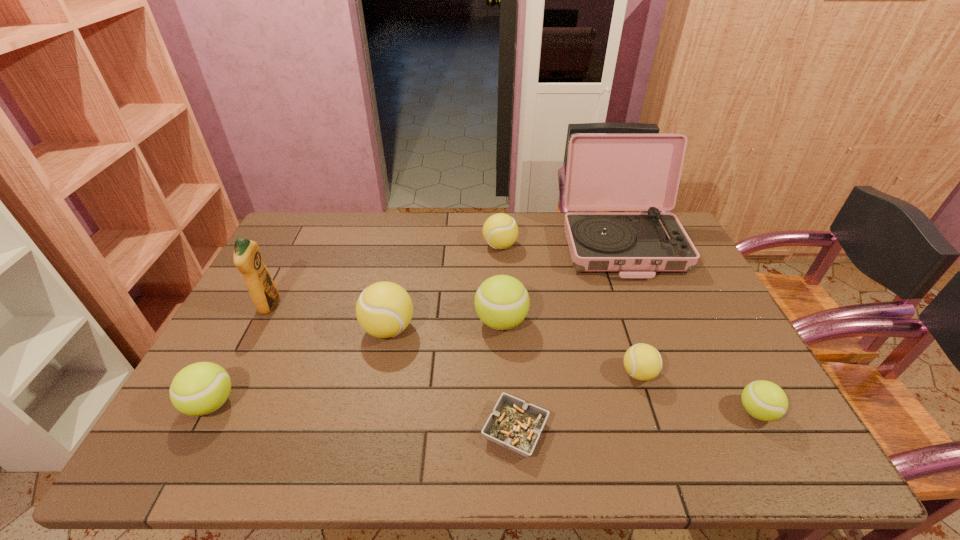
Locate an element on the screen. vacant space that's between the ashtray and the record player is located at coordinates click(x=568, y=338).

Locate an element on the screen. free space between the smallest yellow tennis ball and the second tallest object is located at coordinates (454, 340).

This screenshot has height=540, width=960. I want to click on free space between the ashtray and the detergent, so click(393, 368).

Identify the location of free space between the detergent and the seventh object from right to left. (328, 317).

Find the location of a particular element. vacant space in between the tallest object and the farthest tennis ball is located at coordinates (561, 245).

What are the coordinates of `unoccupied area between the second tallest object and the smallest yellow tennis ball` in the screenshot? It's located at (454, 340).

Identify the location of free space between the fifth tennis ball from left to right and the second tallest object. (454, 340).

Image resolution: width=960 pixels, height=540 pixels. Find the location of `free space between the rightmost yellow tennis ball and the detergent`. free space between the rightmost yellow tennis ball and the detergent is located at coordinates pyautogui.click(x=454, y=340).

You are a GUI agent. You are given a task and a screenshot of the screen. Output one action in this format:
    pyautogui.click(x=<x>, y=<y>)
    Task: Click on the vacant space that is in between the shortest object and the leftmost green tennis ball
    
    Given the screenshot: What is the action you would take?
    pyautogui.click(x=364, y=417)

Locate an element on the screen. This screenshot has width=960, height=540. empty location between the leftmost green tennis ball and the second smallest yellow tennis ball is located at coordinates (355, 325).